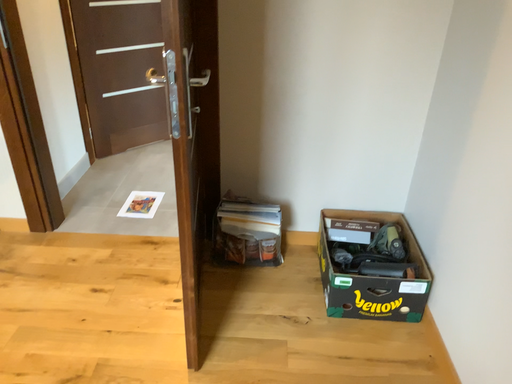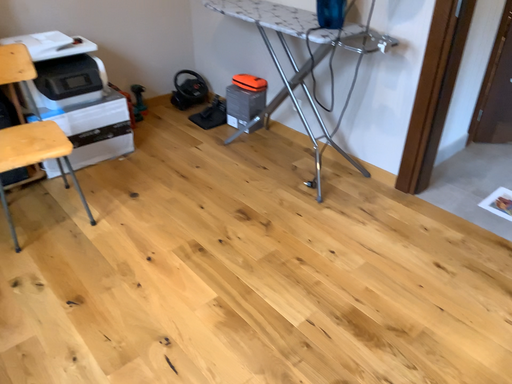
Question: Which way did the camera rotate in the video?

Choices:
 (A) rotated left
 (B) rotated right

Answer: (A)